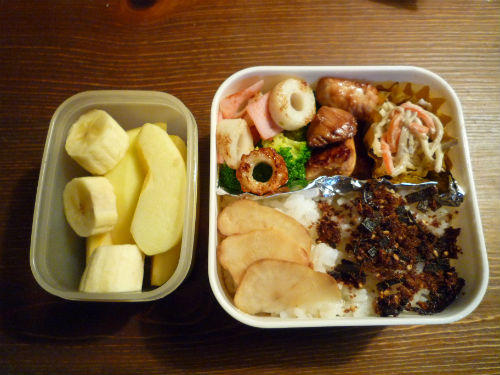
At what (x,y) coordinates should I click in order to perform the action: click on wooden table. Please return your answer as a coordinate pair (x, y). Looking at the image, I should click on (484, 122).